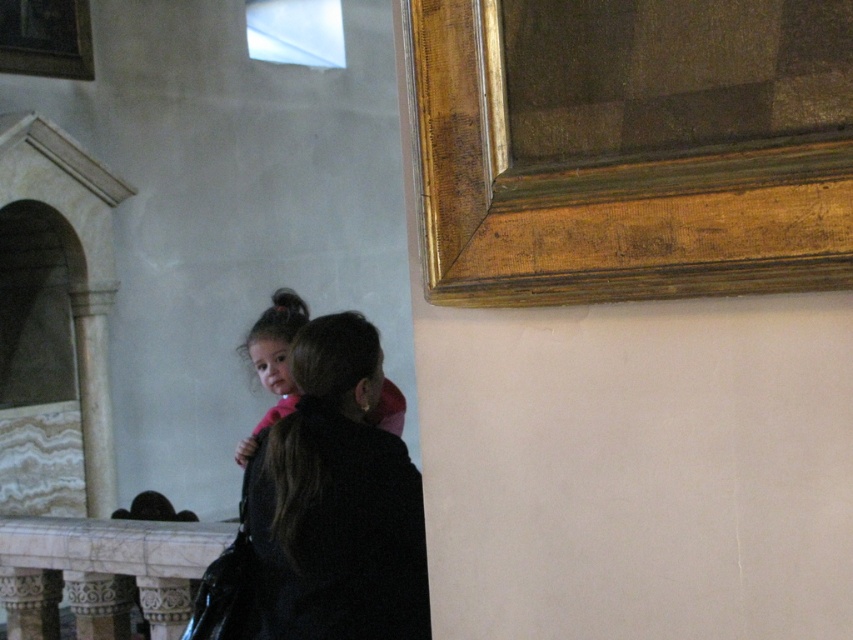
You are standing in a historical building and see a point marked at coordinates (102, 572). What object is located at those coordinates?

The point at coordinates (102, 572) marks the location of the white marble balustrade at lower left.

You are standing in a historical building and see a black matte jacket at center. If you want to reach it, how many steps would you need to take if each step covers 2 feet?

The black matte jacket at center is 6.09 feet away from viewer. Since each step covers 2 feet, you would need to take approximately 3 steps to reach it.

You are an interior designer planning to place a rectangular table that is 1.2 meters wide between the white marble balustrade at lower left and the pink fabric at center. Based on their widths, will the table fit between them?

The white marble balustrade at lower left is wider than the pink fabric at center. Since the table is 1.2 meters wide, it depends on the combined space between them. However, the description only states the balustrade is wider, not the total available space. Without exact measurements of the gap, we cannot confirm if the table will fit.